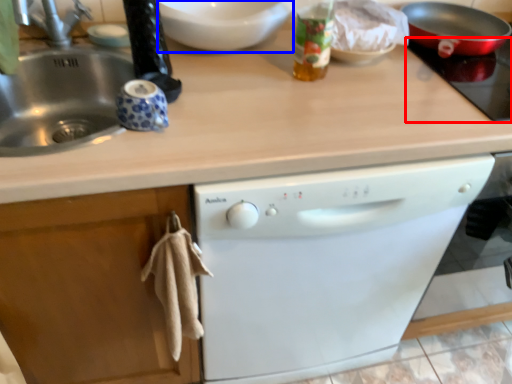
Question: Which object appears farthest to the camera in this image, gas stove (highlighted by a red box) or mixing bowl (highlighted by a blue box)?

Choices:
 (A) gas stove
 (B) mixing bowl

Answer: (B)